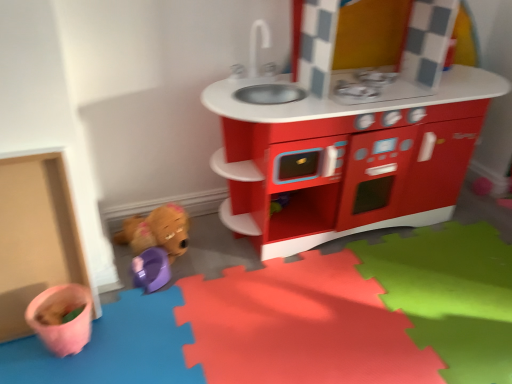
The width and height of the screenshot is (512, 384). In order to click on free space to the back side of purple plastic toy at lower left, which is counted as the second toy, starting from the top in this screenshot , I will do [183, 246].